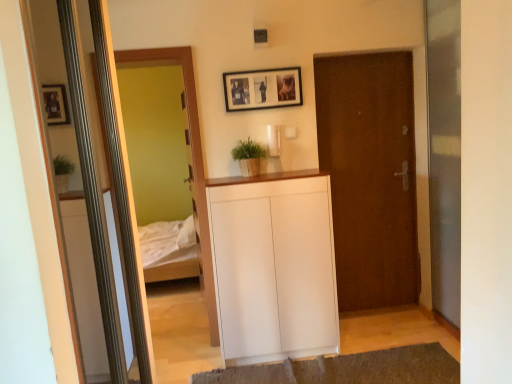
What are the coordinates of `free point above brown matte door at center (from a real-world perspective)` in the screenshot? It's located at (362, 56).